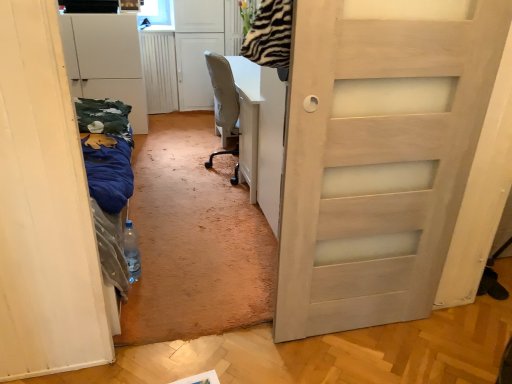
I want to click on vacant region in front of translucent plastic bottle at center, so click(x=144, y=300).